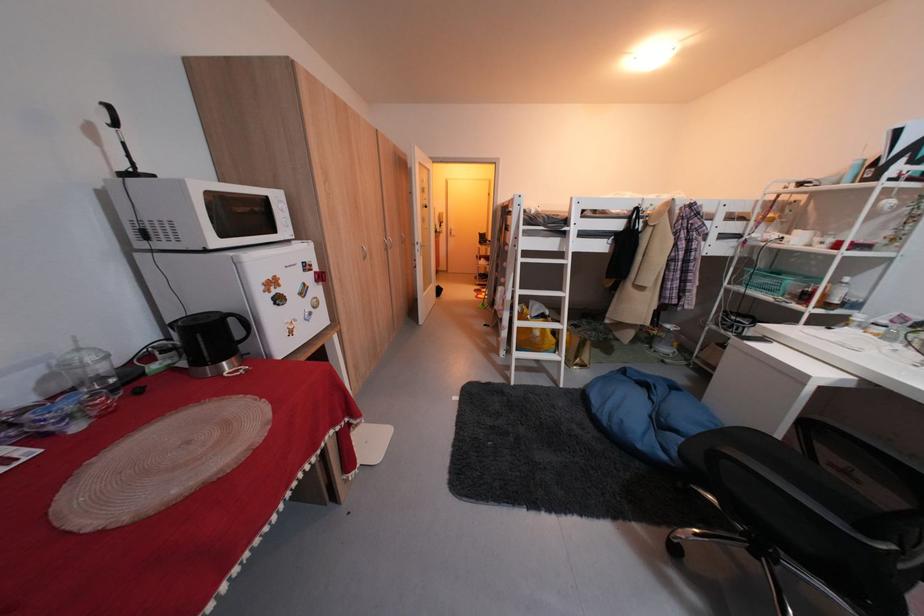
The height and width of the screenshot is (616, 924). I want to click on white door handle, so click(x=419, y=248).